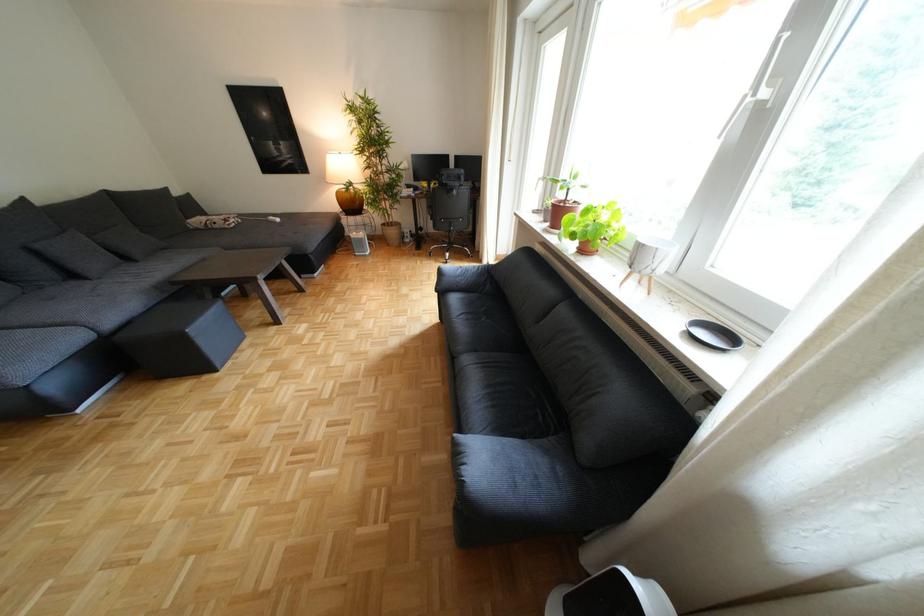
Find where to sit the dark grey sofa sitting surface. Please return your answer as a coordinate pair (x, y).

(492, 323)